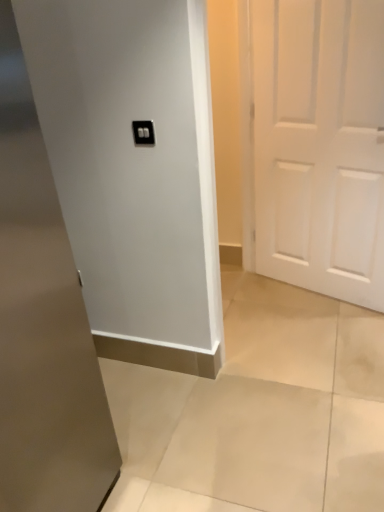
Question: From the image's perspective, is white glossy door at center, marked as the 2th door in a right-to-left arrangement, positioned above or below white matte door at right, which is the second door from left to right?

Choices:
 (A) above
 (B) below

Answer: (B)

Question: Considering the positions of white glossy door at center, marked as the 2th door in a right-to-left arrangement, and white matte door at right, arranged as the second door when viewed from the front, in the image, is white glossy door at center, marked as the 2th door in a right-to-left arrangement, wider or thinner than white matte door at right, arranged as the second door when viewed from the front,?

Choices:
 (A) wide
 (B) thin

Answer: (A)

Question: Based on their relative distances, which object is nearer to the black plastic light switch at upper center?

Choices:
 (A) beige polished concrete at lower center
 (B) white matte door at right, which is the second door from left to right
 (C) white glossy door at center, the first door viewed from the front

Answer: (C)

Question: Which object is positioned closest to the white glossy door at center, the 1th door from the left?

Choices:
 (A) white matte door at right, acting as the first door starting from the back
 (B) beige polished concrete at lower center
 (C) black plastic light switch at upper center

Answer: (B)